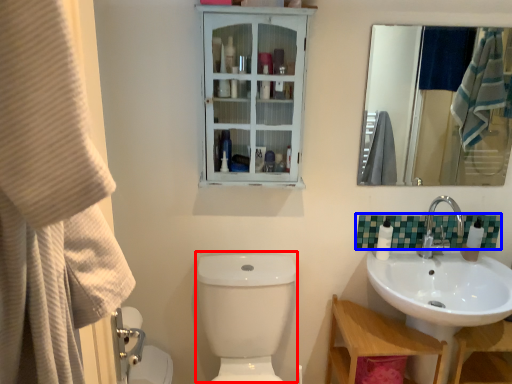
Question: Which of the following is the farthest to the observer, toilet bowl (highlighted by a red box) or tile (highlighted by a blue box)?

Choices:
 (A) toilet bowl
 (B) tile

Answer: (B)